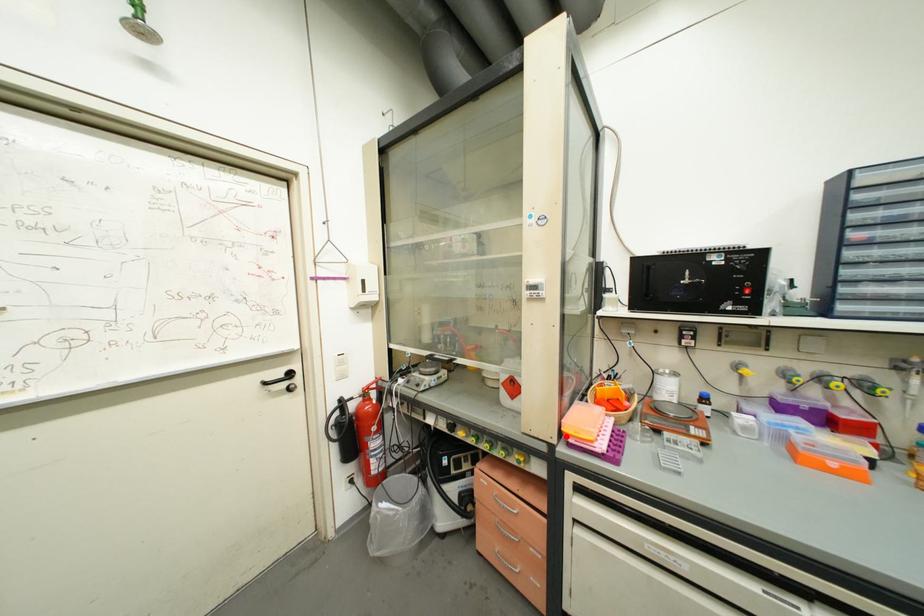
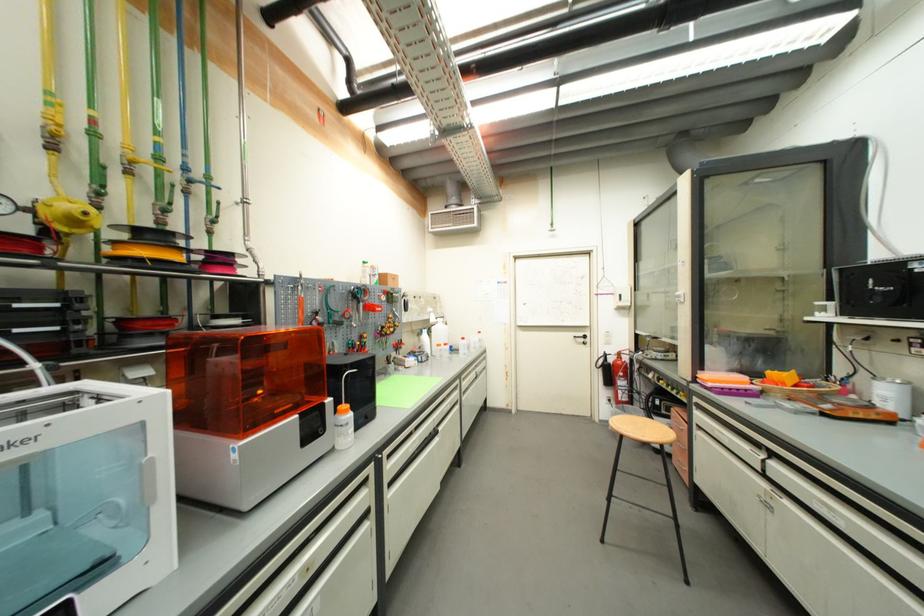
Find the pixel in the second image that matches the highlighted location in the first image.

(699, 379)